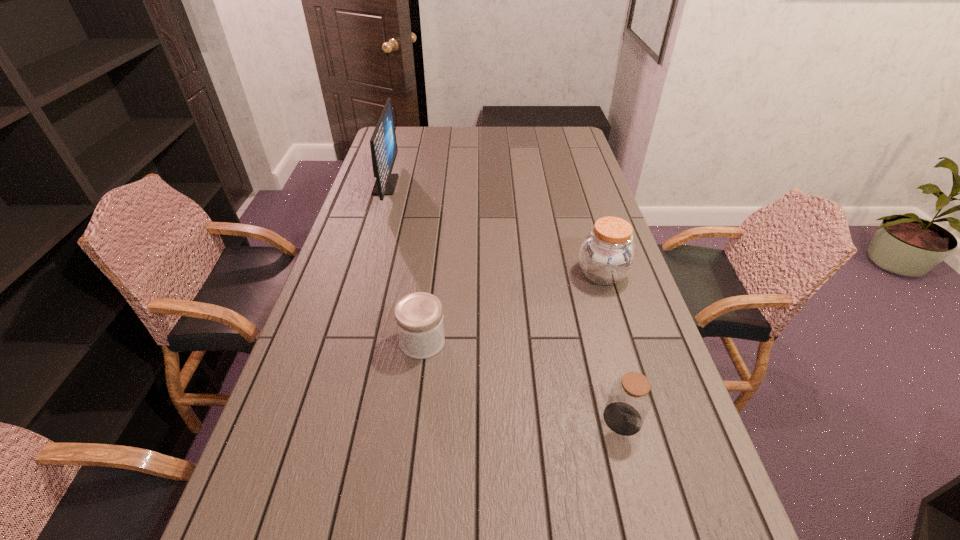
At what (x,y) coordinates should I click in order to perform the action: click on vacant space situated on the front of the second farthest jar. Please return your answer as a coordinate pair (x, y). Looking at the image, I should click on (418, 380).

You are a GUI agent. You are given a task and a screenshot of the screen. Output one action in this format:
    pyautogui.click(x=<x>, y=<y>)
    Task: Click on the object positioned at the left edge
    The image size is (960, 540).
    Given the screenshot: What is the action you would take?
    (383, 144)

The width and height of the screenshot is (960, 540). I want to click on free region at the far edge, so click(504, 127).

Image resolution: width=960 pixels, height=540 pixels. I want to click on free space at the left edge of the desktop, so click(x=345, y=244).

This screenshot has width=960, height=540. I want to click on vacant space at the right edge of the desktop, so click(x=550, y=152).

What are the coordinates of `vacant space at the far right corner of the desktop` in the screenshot? It's located at coord(568,138).

In order to click on free space between the tallest jar and the farthest object in this screenshot , I will do `click(494, 230)`.

Find the location of a particular element. This screenshot has width=960, height=540. free space between the leftmost object and the third nearest object is located at coordinates tap(494, 230).

This screenshot has width=960, height=540. Find the location of `free point between the nearest object and the leftmost object`. free point between the nearest object and the leftmost object is located at coordinates (504, 302).

Locate an element on the screen. The width and height of the screenshot is (960, 540). unoccupied area between the nearest jar and the leftmost jar is located at coordinates (522, 380).